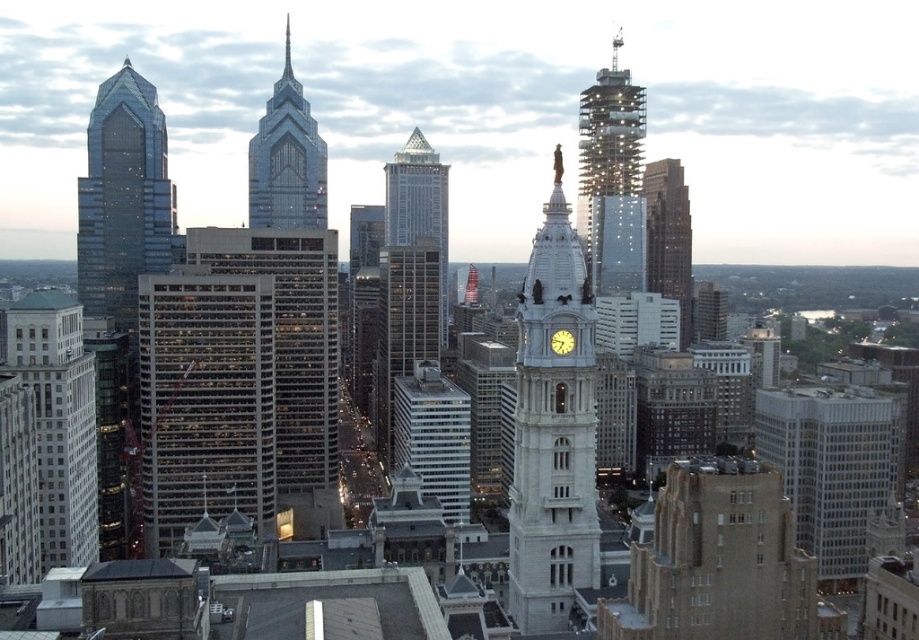
Is point (202, 292) less distant than point (636, 216)?

Yes.

Identify the location of gray concrete skyscraper at center. (240, 381).

Between gray concrete skyscraper at center and white marble building at left, which one appears on the left side from the viewer's perspective?

Positioned to the left is white marble building at left.

Which is more to the right, gray concrete skyscraper at center or white marble building at left?

From the viewer's perspective, gray concrete skyscraper at center appears more on the right side.

Which is in front, point (335, 346) or point (69, 544)?

Positioned in front is point (69, 544).

This screenshot has width=919, height=640. Identify the location of gray concrete skyscraper at center. (240, 381).

Can you confirm if shiny glass spire at upper center is positioned below metallic spire at upper right?

Yes, shiny glass spire at upper center is below metallic spire at upper right.

Is point (286, 26) in front of point (614, 64)?

Yes, it is in front of point (614, 64).

The image size is (919, 640). Find the location of `shiny glass spire at upper center`. shiny glass spire at upper center is located at coordinates (287, 51).